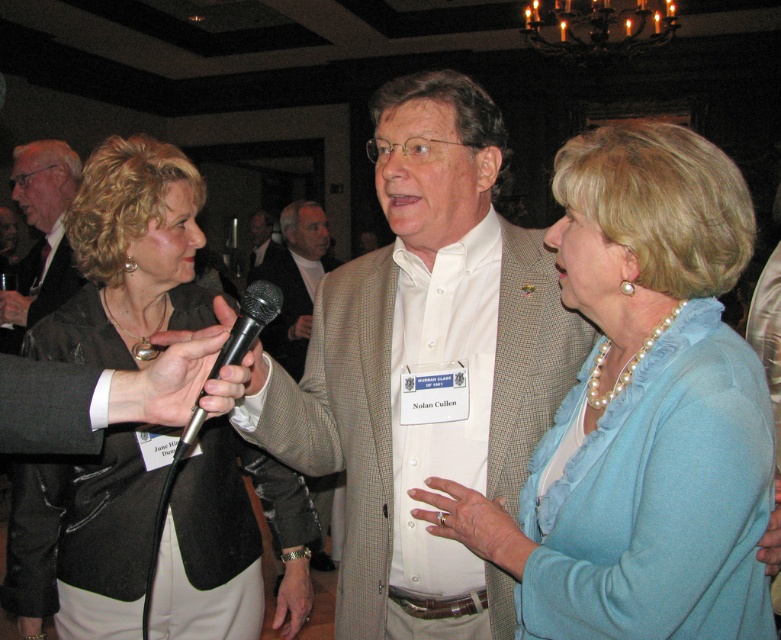
You are a photographer at the event and need to ensure the pearl necklace at center and white shirt at center are both visible in the photo. Given their sizes, which one might you need to adjust your camera focus on to capture clearly?

The pearl necklace at center is not as tall as the white shirt at center, so you might need to adjust focus on the smaller pearl necklace at center to ensure clarity.